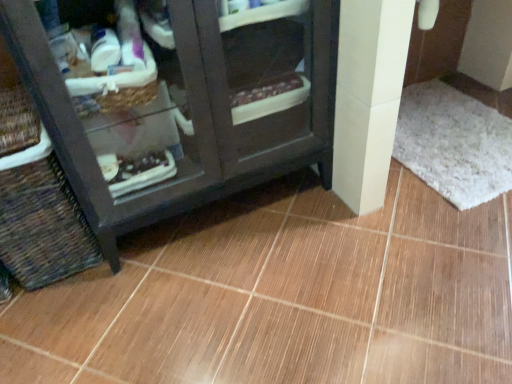
Identify the location of free spot below dark wood cabinet at lower left (from a real-world perspective). This screenshot has width=512, height=384. (210, 215).